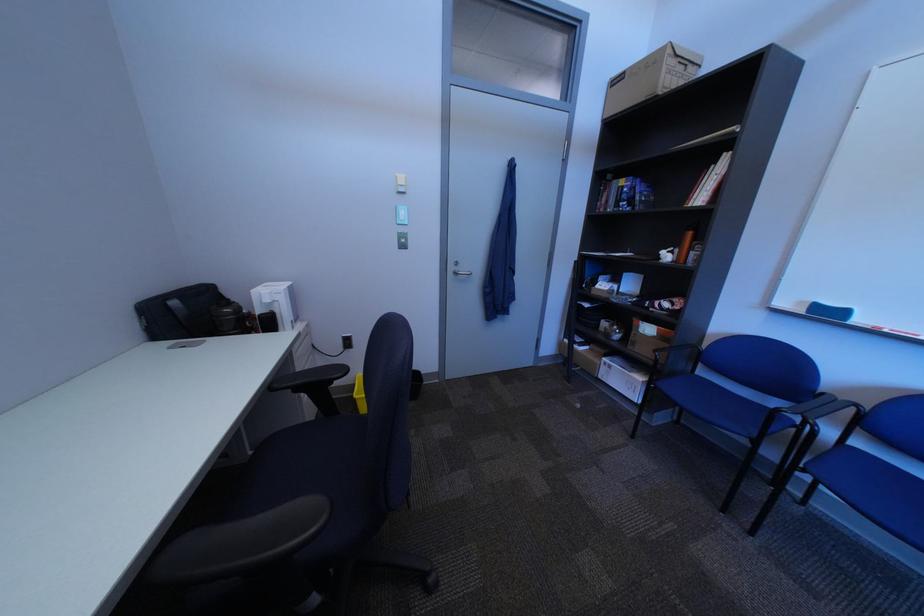
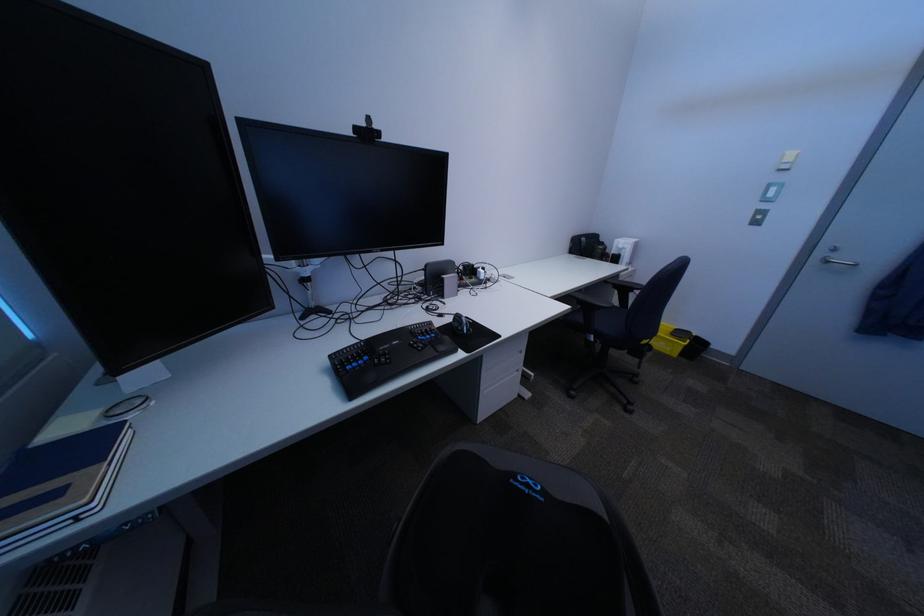
The point at [274,312] is marked in the first image. Where is the corresponding point in the second image?

(628, 254)